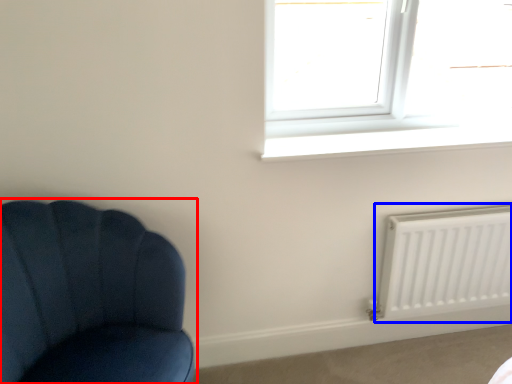
Question: Which object is further to the camera taking this photo, chair (highlighted by a red box) or radiator (highlighted by a blue box)?

Choices:
 (A) chair
 (B) radiator

Answer: (B)